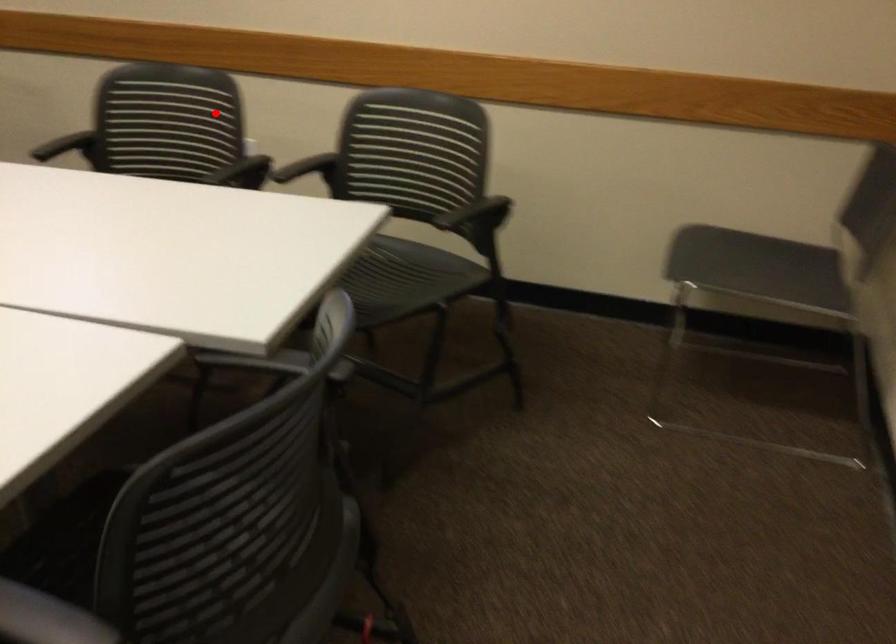
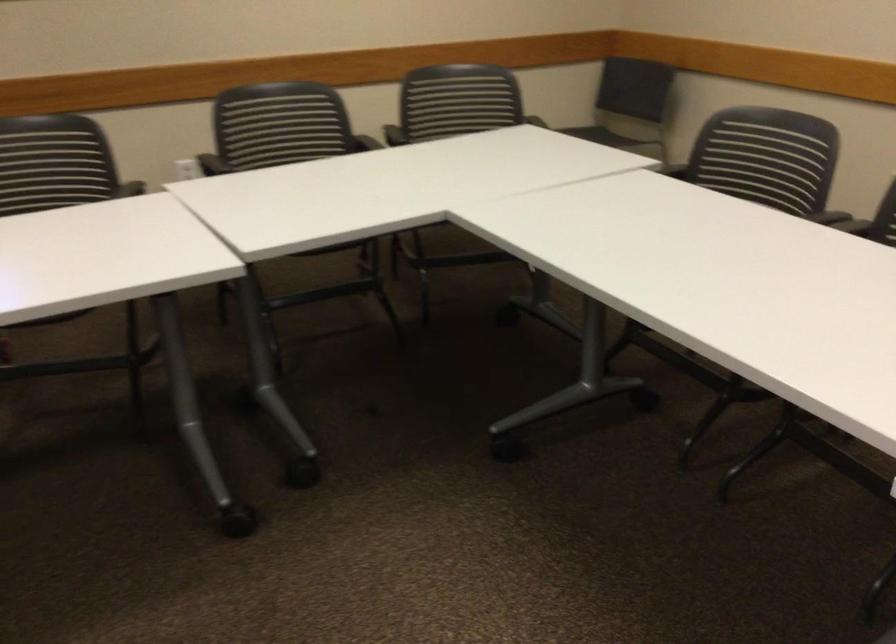
Question: I am providing you with two images of the same scene from different viewpoints. In image1, a red point is highlighted. Considering the same 3D point in image2, which of the following is correct?

Choices:
 (A) It is closer
 (B) It is farther

Answer: (B)